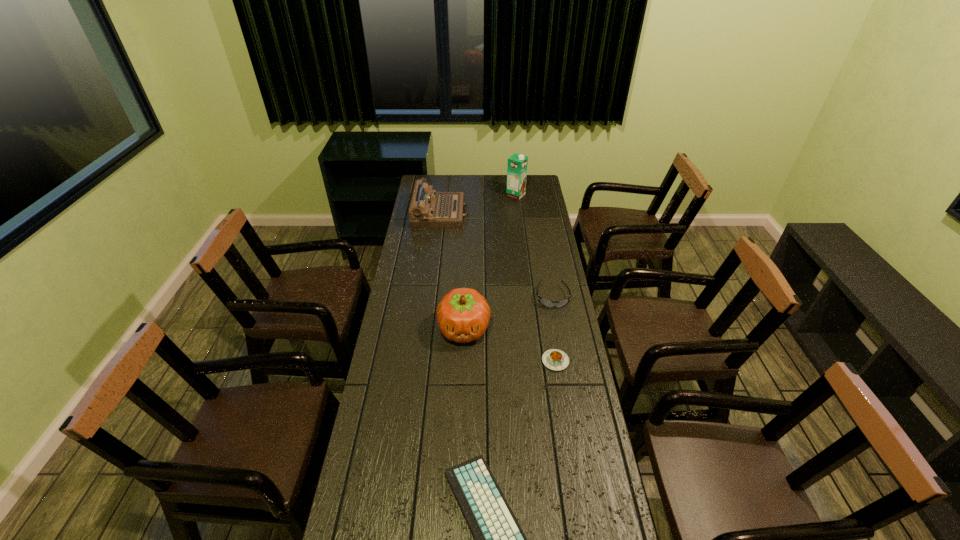
Where is `vacant space that's between the pudding and the carton`? This screenshot has width=960, height=540. vacant space that's between the pudding and the carton is located at coordinates coord(536,278).

Where is `free space between the fourth tallest object and the typewriter`? The image size is (960, 540). free space between the fourth tallest object and the typewriter is located at coordinates (496, 255).

Locate an element on the screen. empty space that is in between the third tallest object and the fifth farthest object is located at coordinates (498, 287).

Find the location of a particular element. free spot between the third tallest object and the fifth farthest object is located at coordinates (498, 287).

Identify the location of free space between the typewriter and the sunglasses. (x=496, y=255).

You are a GUI agent. You are given a task and a screenshot of the screen. Output one action in this format:
    pyautogui.click(x=<x>, y=<y>)
    Task: Click on the vacant space in between the third shortest object and the tallest object
    
    Given the screenshot: What is the action you would take?
    pyautogui.click(x=534, y=246)

I want to click on vacant area between the third tallest object and the tallest object, so click(478, 205).

The image size is (960, 540). Identify the location of blank region between the second tallest object and the typewriter. (452, 271).

Identify the location of free space between the pumpkin and the typewriter. (452, 271).

Locate which object is the closest to the typewriter. Please provide its 2D coordinates. Your answer should be formatted as a tuple, i.e. [(x, y)], where the tuple contains the x and y coordinates of a point satisfying the conditions above.

[(517, 165)]